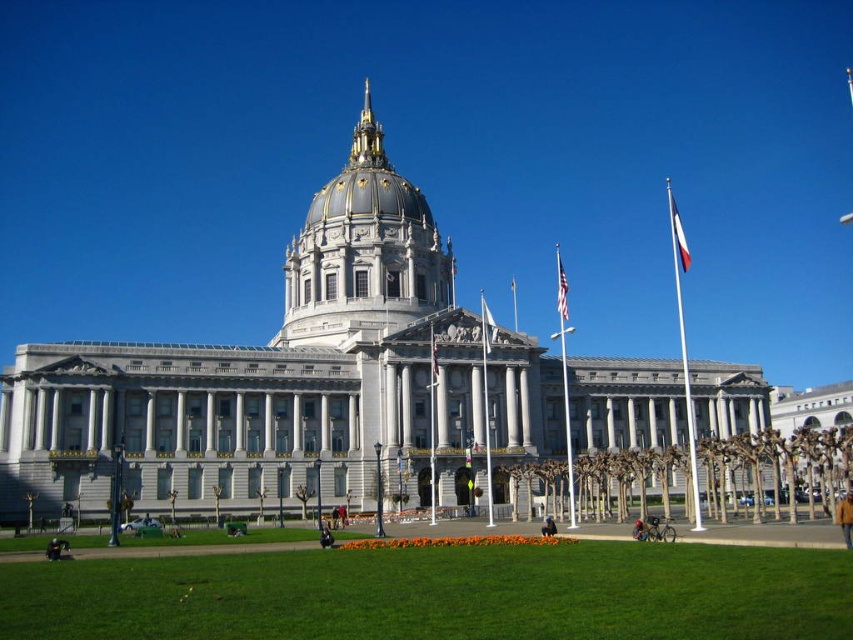
Question: Among these points, which one is farthest from the camera?

Choices:
 (A) click(489, 323)
 (B) click(561, 314)
 (C) click(344, 218)

Answer: (B)

Question: Is denim jacket at lower right positioned in front of red fabric flag at center?

Choices:
 (A) yes
 (B) no

Answer: (A)

Question: Is the position of white fabric flag at center less distant than that of american flag at center?

Choices:
 (A) yes
 (B) no

Answer: (A)

Question: Is brown leather jacket at lower right above dark blue jeans at lower center?

Choices:
 (A) no
 (B) yes

Answer: (B)

Question: Which object is positioned farthest from the dark blue jeans at lower center?

Choices:
 (A) white fabric flag at right
 (B) white fabric flag at center
 (C) green grass at lower center
 (D) denim jacket at lower right

Answer: (A)

Question: Among these objects, which one is farthest from the camera?

Choices:
 (A) white fabric flag at center
 (B) gold/gilded dome at center
 (C) red fabric flag at center
 (D) green grass at lower center

Answer: (A)